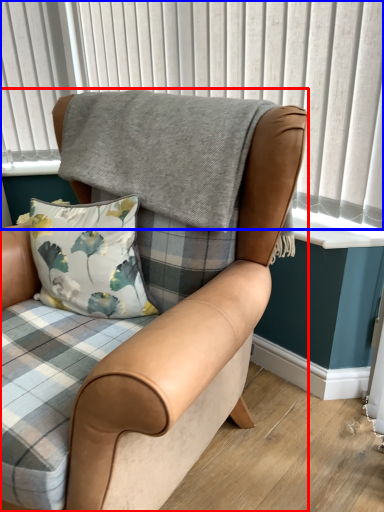
Question: Which object appears closest to the camera in this image, chair (highlighted by a red box) or window frame (highlighted by a blue box)?

Choices:
 (A) chair
 (B) window frame

Answer: (A)